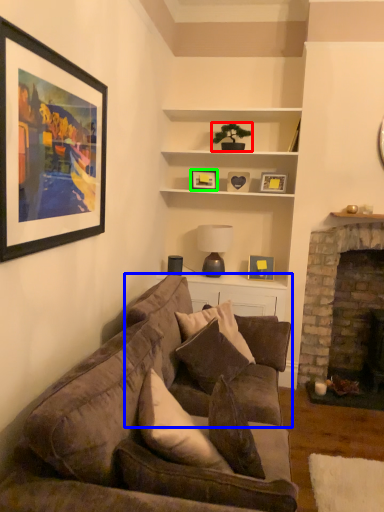
Question: Considering the real-world distances, which object is closest to houseplant (highlighted by a red box)? studio couch (highlighted by a blue box) or picture frame (highlighted by a green box).

Choices:
 (A) studio couch
 (B) picture frame

Answer: (B)